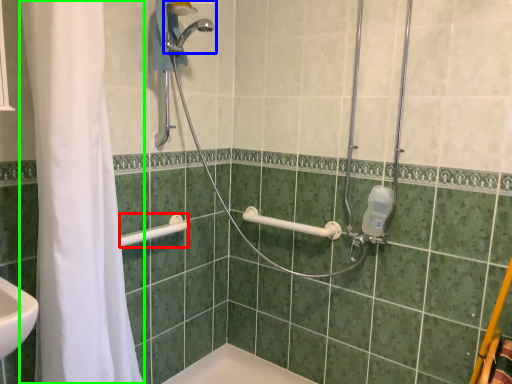
Question: Which object is the farthest from shower (highlighted by a red box)? Choose among these: shower (highlighted by a blue box) or shower curtain (highlighted by a green box).

Choices:
 (A) shower
 (B) shower curtain

Answer: (A)